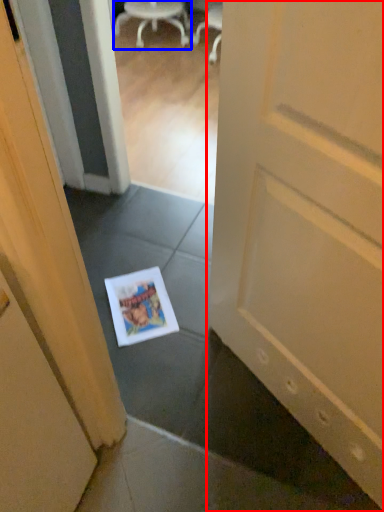
Question: Which point is further to the camera, door (highlighted by a red box) or chair (highlighted by a blue box)?

Choices:
 (A) door
 (B) chair

Answer: (B)